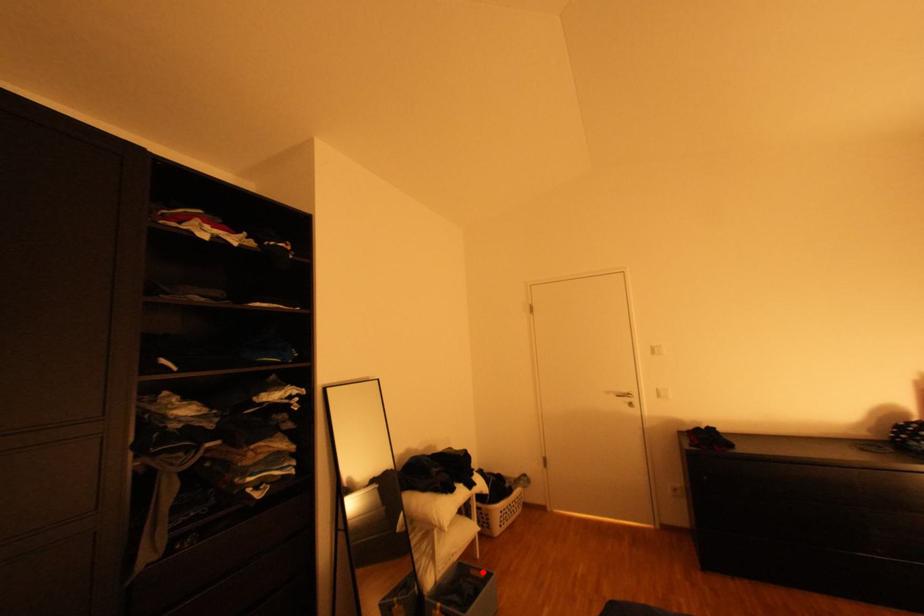
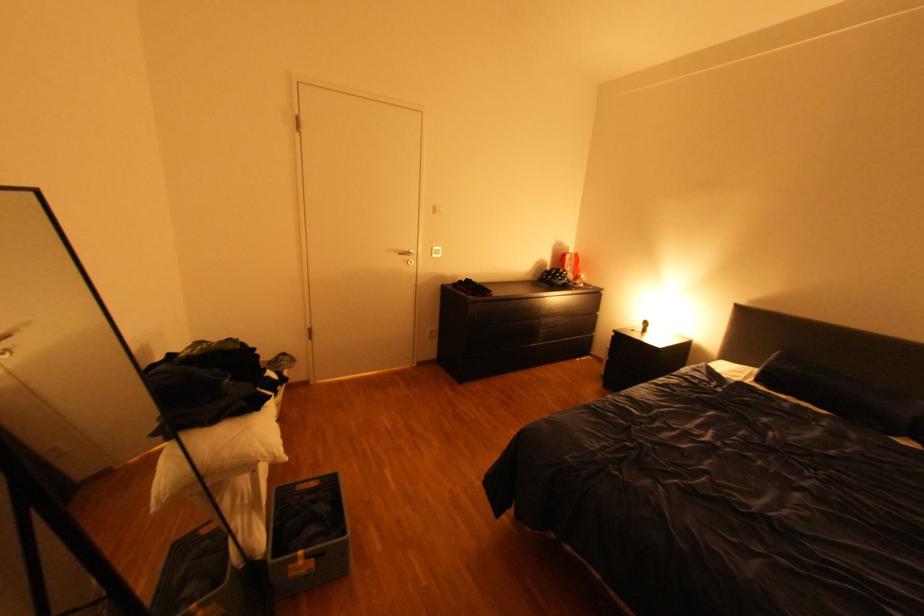
Find the pixel in the second image that matches the highlighted location in the first image.

(310, 488)